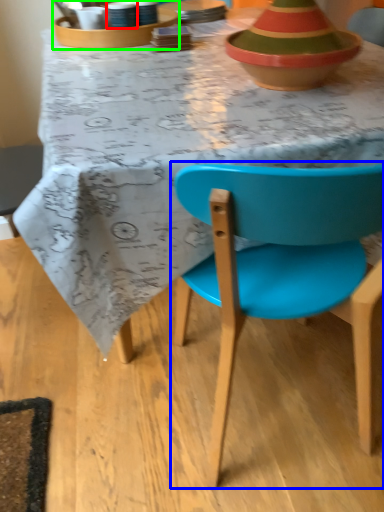
Question: Which object is positioned closest to tableware (highlighted by a red box)? Select from chair (highlighted by a blue box) and tableware (highlighted by a green box).

Choices:
 (A) chair
 (B) tableware

Answer: (B)